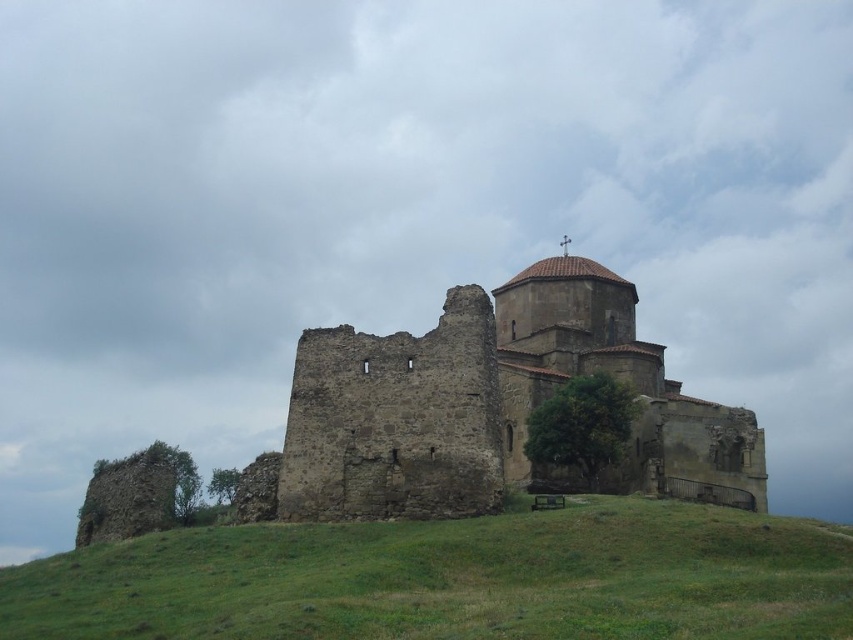
Who is positioned more to the left, green grassy hillside at lower center or rustic stone castle at center?

From the viewer's perspective, green grassy hillside at lower center appears more on the left side.

The image size is (853, 640). What do you see at coordinates (451, 579) in the screenshot?
I see `green grassy hillside at lower center` at bounding box center [451, 579].

Describe the element at coordinates (451, 579) in the screenshot. This screenshot has height=640, width=853. I see `green grassy hillside at lower center` at that location.

The image size is (853, 640). I want to click on green grassy hillside at lower center, so click(451, 579).